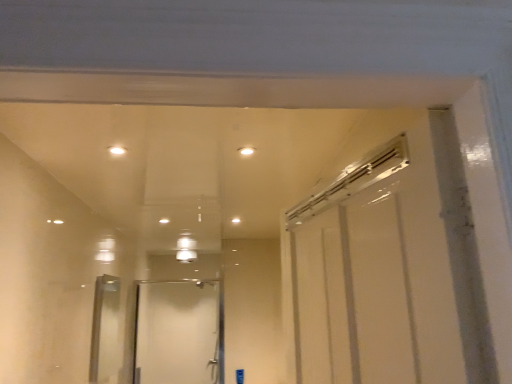
Question: Considering the relative sizes of white glossy light at upper center, which is the second light in left-to-right order, and white glossy light at upper center, the 1th light in the left-to-right sequence, in the image provided, is white glossy light at upper center, which is the second light in left-to-right order, taller than white glossy light at upper center, the 1th light in the left-to-right sequence,?

Choices:
 (A) no
 (B) yes

Answer: (A)

Question: Considering the relative sizes of white glossy light at upper center, which is the 1th light from right to left, and white glossy light at upper center, the 1th light in the left-to-right sequence, in the image provided, is white glossy light at upper center, which is the 1th light from right to left, smaller than white glossy light at upper center, the 1th light in the left-to-right sequence,?

Choices:
 (A) no
 (B) yes

Answer: (B)

Question: Considering the relative sizes of white glossy light at upper center, which is the 1th light from right to left, and white glossy light at upper center, the 1th light in the left-to-right sequence, in the image provided, is white glossy light at upper center, which is the 1th light from right to left, bigger than white glossy light at upper center, the 1th light in the left-to-right sequence,?

Choices:
 (A) yes
 (B) no

Answer: (B)

Question: Is white glossy light at upper center, which is the second light in left-to-right order, touching white glossy light at upper center, the 1th light in the left-to-right sequence?

Choices:
 (A) no
 (B) yes

Answer: (A)

Question: Is white glossy light at upper center, which is the second light in left-to-right order, oriented towards white glossy light at upper center, the 1th light in the left-to-right sequence?

Choices:
 (A) yes
 (B) no

Answer: (B)

Question: Is white glossy light at upper center, which is the second light in left-to-right order, facing away from white glossy light at upper center, arranged as the 2th light when viewed from the right?

Choices:
 (A) no
 (B) yes

Answer: (A)

Question: Is clear glass door at center behind white glossy light at upper center, which is the second light in left-to-right order?

Choices:
 (A) yes
 (B) no

Answer: (A)

Question: From a real-world perspective, is clear glass door at center over white glossy light at upper center, which is the 1th light from right to left?

Choices:
 (A) no
 (B) yes

Answer: (A)

Question: Does clear glass door at center have a lesser width compared to white glossy light at upper center, which is the 1th light from right to left?

Choices:
 (A) no
 (B) yes

Answer: (A)

Question: From the image's perspective, is clear glass door at center located beneath white glossy light at upper center, which is the second light in left-to-right order?

Choices:
 (A) yes
 (B) no

Answer: (A)

Question: Are clear glass door at center and white glossy light at upper center, which is the 1th light from right to left, located far from each other?

Choices:
 (A) yes
 (B) no

Answer: (A)

Question: Is clear glass door at center next to white glossy light at upper center, which is the 1th light from right to left, and touching it?

Choices:
 (A) yes
 (B) no

Answer: (B)

Question: Does clear glass door at center appear on the right side of white glossy light at upper center, arranged as the 2th light when viewed from the right?

Choices:
 (A) yes
 (B) no

Answer: (B)